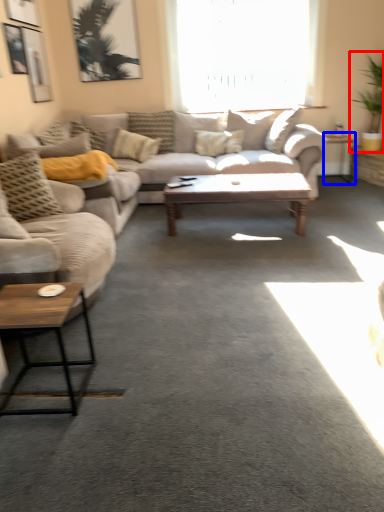
Question: Which object appears closest to the camera in this image, houseplant (highlighted by a red box) or table (highlighted by a blue box)?

Choices:
 (A) houseplant
 (B) table

Answer: (A)